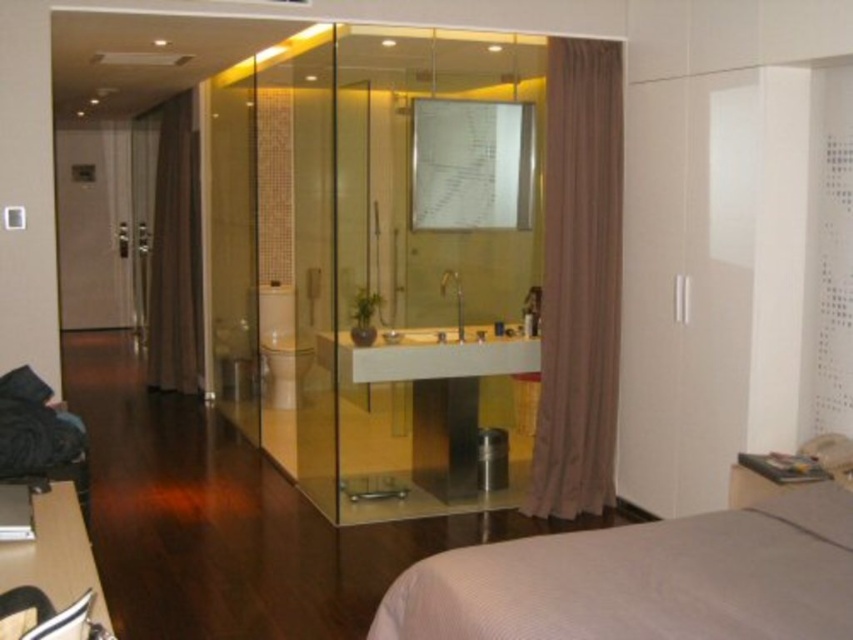
You are moving a small table that is 1.2 meters wide into the space. You want to place it between the gray fabric bed at lower right and the brown sheer curtain at right. Can the table fit there?

The gray fabric bed at lower right is wider than the brown sheer curtain at right. The distance between them is not specified, but since the bed is wider, the space between might accommodate the 1.2 meter table. However, without exact measurements, it is uncertain. Please check the actual space.

You are standing in the bedroom and want to walk from the gray fabric bed at lower right to the brown sheer curtain at right. Which object will you encounter first?

You will encounter the gray fabric bed at lower right first because it is closer to you than the brown sheer curtain at right.